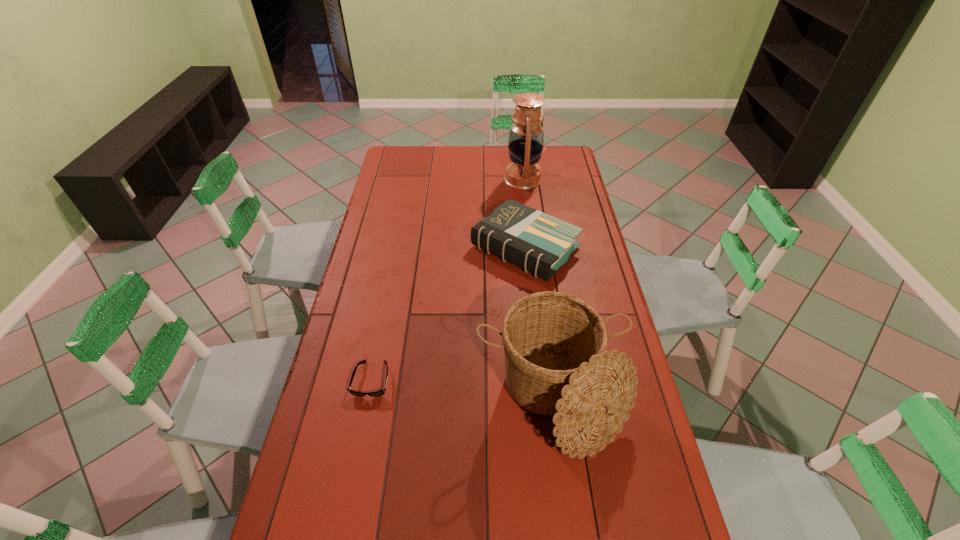
You are a GUI agent. You are given a task and a screenshot of the screen. Output one action in this format:
    pyautogui.click(x=<x>, y=<y>)
    Task: Click on the farthest object
    The width and height of the screenshot is (960, 540).
    Given the screenshot: What is the action you would take?
    pyautogui.click(x=526, y=137)

This screenshot has width=960, height=540. Find the location of `the tallest object`. the tallest object is located at coordinates (526, 137).

The image size is (960, 540). Find the location of `basket`. basket is located at coordinates pyautogui.click(x=556, y=362).

Find the location of a particular element. Image resolution: width=960 pixels, height=540 pixels. paperback book is located at coordinates (539, 243).

Image resolution: width=960 pixels, height=540 pixels. Identify the location of the second shortest object. (539, 243).

Locate an element on the screen. Image resolution: width=960 pixels, height=540 pixels. the leftmost object is located at coordinates (378, 393).

Where is `sunglasses`? sunglasses is located at coordinates (378, 393).

At what (x,y) coordinates should I click in order to perform the action: click on vacant space located on the front of the oil lamp. Please return your answer as a coordinate pair (x, y). Image resolution: width=960 pixels, height=540 pixels. Looking at the image, I should click on (532, 247).

What are the coordinates of `free space located 0.340m on the back of the second tallest object` in the screenshot? It's located at (536, 271).

Locate an element on the screen. The image size is (960, 540). vacant region located 0.250m on the back of the third nearest object is located at coordinates (518, 184).